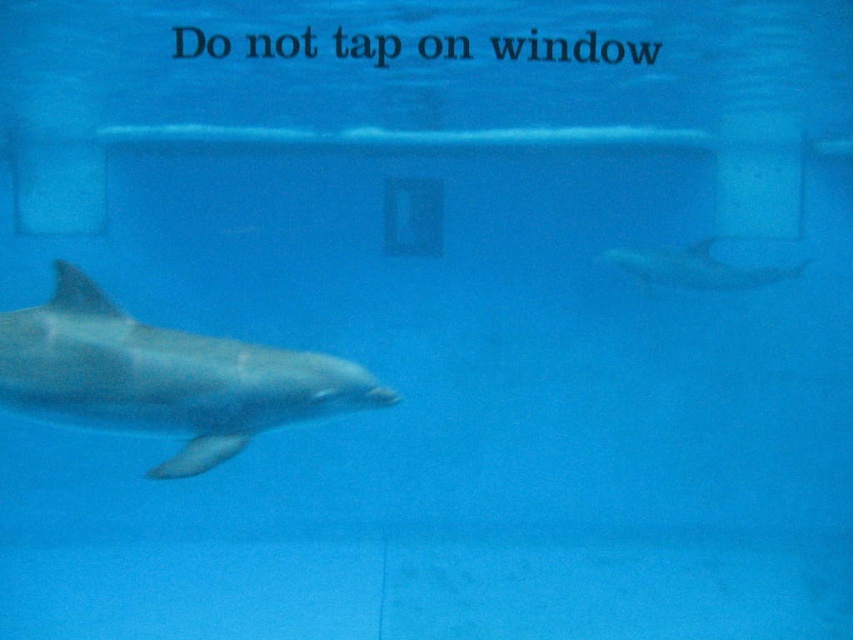
You are a marine biologist observing two points in the dolphin tank. The first point is at coordinates point (358, 406) and the second is at point (657, 262). Based on your observation, which point is closer to you?

Point (358, 406) is closer to the viewer than point (657, 262).

You are a visitor at the aquarium and want to take a photo of both the smooth gray dolphin at left and the smooth gray dolphin at upper right through the viewing window. Which dolphin will appear lower in your photo?

The smooth gray dolphin at left will appear lower in your photo because it is located below the smooth gray dolphin at upper right in the image.

You are a marine biologist observing two smooth gray dolphins in an aquarium. You notice the smooth gray dolphin at left and the smooth gray dolphin at upper right. Which dolphin is taller?

The smooth gray dolphin at left is much taller than the smooth gray dolphin at upper right.